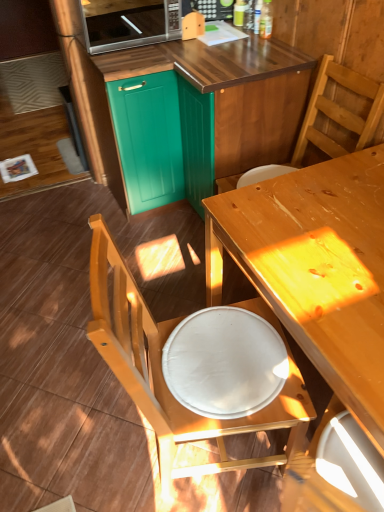
The width and height of the screenshot is (384, 512). Identify the location of free location to the left of teal matte cabinet at upper center, arranged as the second cabinetry when viewed from the right. (78, 207).